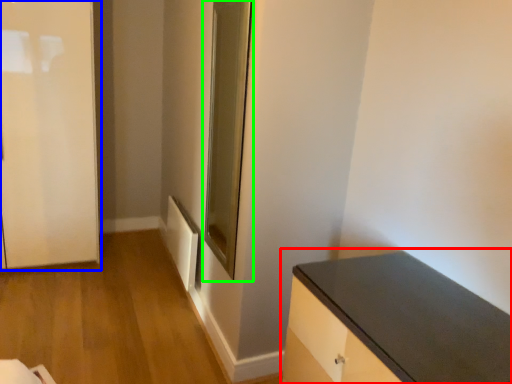
Question: Which object is positioned farthest from countertop (highlighted by a red box)? Select from door (highlighted by a blue box) and glass door (highlighted by a green box).

Choices:
 (A) door
 (B) glass door

Answer: (A)